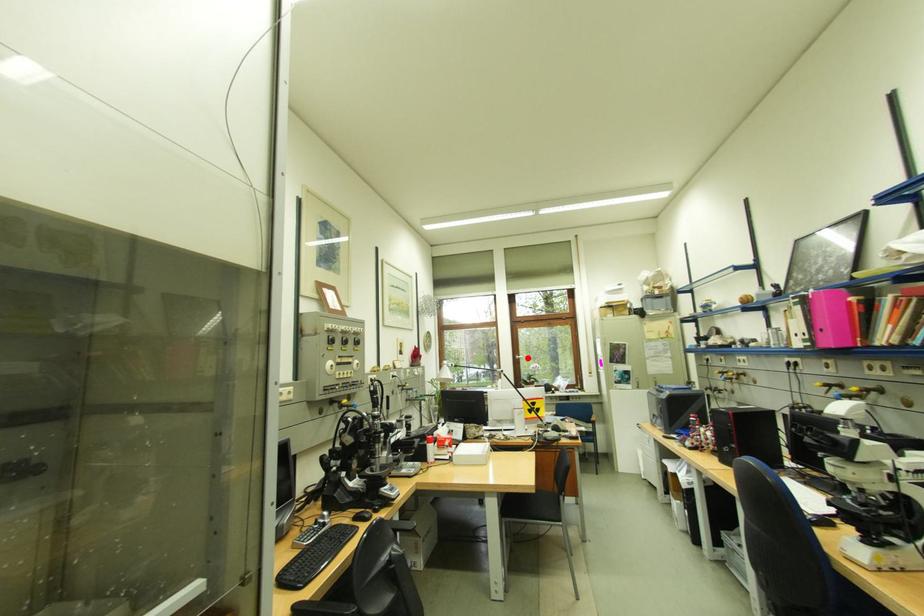
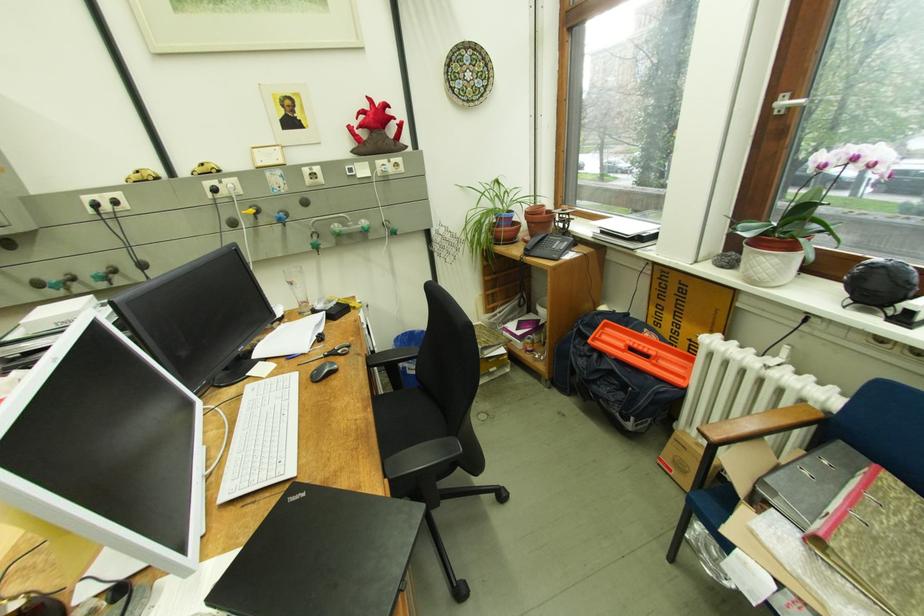
Locate, in the second image, the point that corresponds to the highlighted location in the first image.

(794, 103)